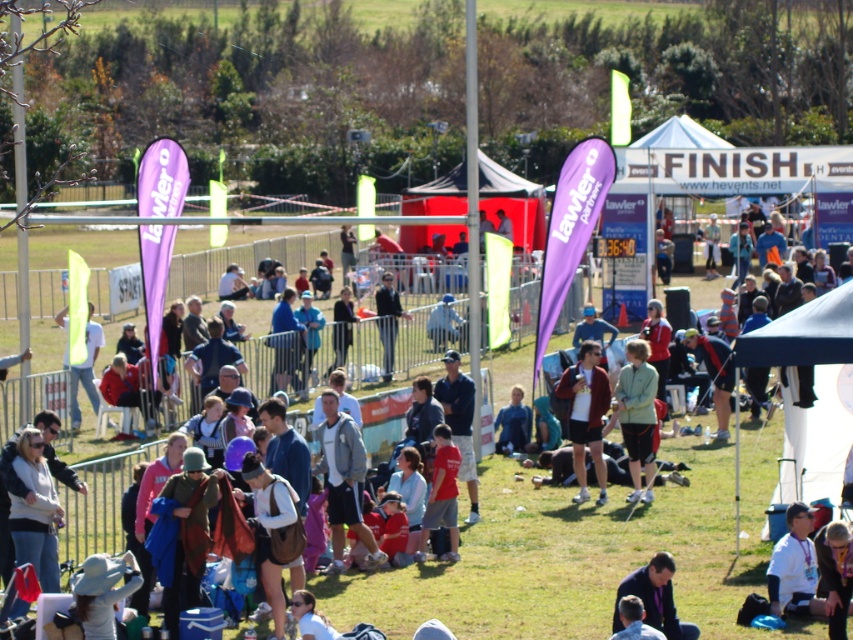
Question: Considering the real-world distances, which object is farthest from the white fabric shirt at lower right?

Choices:
 (A) light green fabric at left
 (B) light green fabric jacket at center
 (C) red cotton shirt at center

Answer: (A)

Question: Can you confirm if light green fabric at left is bigger than light blue shirt at lower center?

Choices:
 (A) no
 (B) yes

Answer: (A)

Question: Can you confirm if gray fabric jacket at center is thinner than matte black jacket at center?

Choices:
 (A) yes
 (B) no

Answer: (B)

Question: Which object is positioned farthest from the light green fabric at left?

Choices:
 (A) light green fabric jacket at center
 (B) matte red jacket at center
 (C) gray fabric jacket at center

Answer: (C)

Question: Which of these objects is positioned farthest from the dark blue jacket at center?

Choices:
 (A) light green fabric jacket at center
 (B) gray fabric jacket at center
 (C) blue fabric tent at center
 (D) matte red jacket at center

Answer: (C)

Question: Is matte red jacket at center positioned at the back of dark blue jacket at center?

Choices:
 (A) yes
 (B) no

Answer: (B)